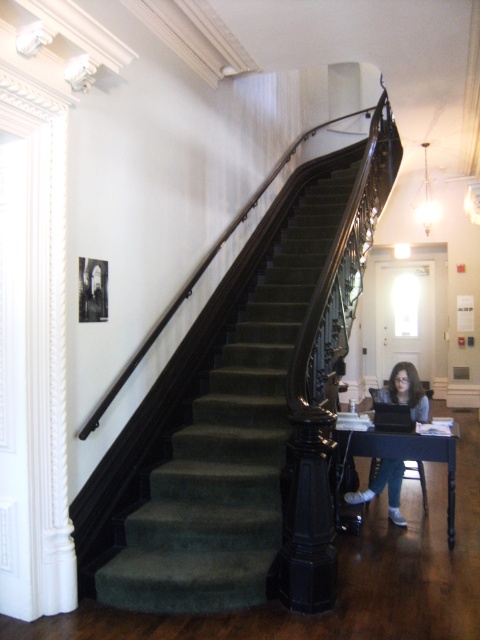
Question: Is green velvet stairwell at center thinner than matte gray sweater at lower center?

Choices:
 (A) yes
 (B) no

Answer: (B)

Question: Does green velvet stairwell at center have a smaller size compared to matte gray sweater at lower center?

Choices:
 (A) no
 (B) yes

Answer: (A)

Question: Which object appears farthest from the camera in this image?

Choices:
 (A) dark wood table at lower right
 (B) green velvet stairwell at center

Answer: (A)

Question: Which object appears closest to the camera in this image?

Choices:
 (A) green velvet stairwell at center
 (B) matte gray sweater at lower center
 (C) dark wood table at lower right

Answer: (A)

Question: Does dark wood table at lower right appear on the right side of matte gray sweater at lower center?

Choices:
 (A) no
 (B) yes

Answer: (B)

Question: Which object appears farthest from the camera in this image?

Choices:
 (A) dark wood table at lower right
 (B) matte gray sweater at lower center
 (C) green velvet stairwell at center

Answer: (B)